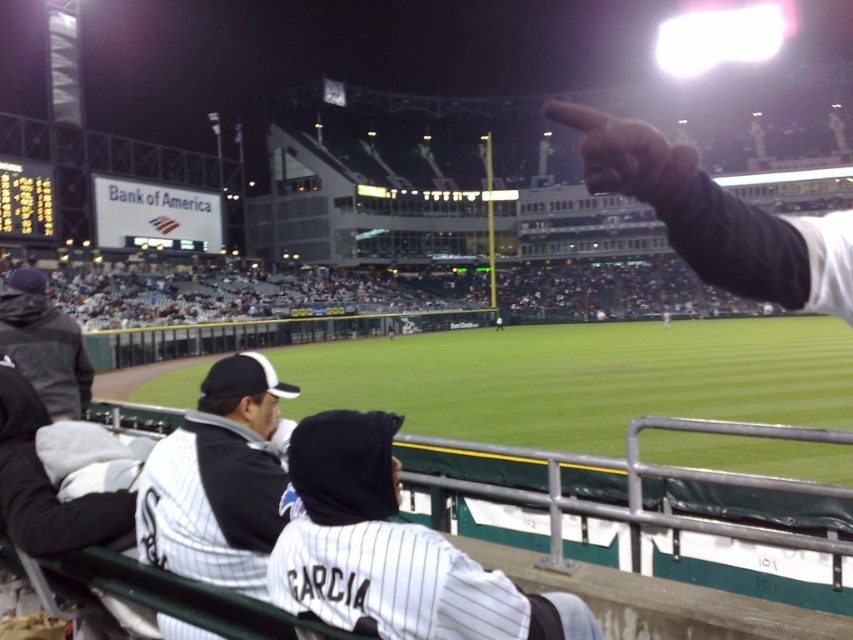
You are a photographer at the baseball stadium and want to capture a photo that includes both the white pinstriped jersey at center and the matte black finger at upper right. Based on their heights, which object should you focus on first to ensure both are in frame?

The white pinstriped jersey at center has a lesser height compared to the matte black finger at upper right, so you should focus on the matte black finger at upper right first to ensure both are in frame.

You are a photographer at the baseball stadium and want to take a photo of the white pinstriped jersey at center. Where should you position yourself to ensure the jersey is in the center of your photo?

To center the white pinstriped jersey at center in your photo, position yourself directly in line with its coordinates at point (392, 550). This will ensure the jersey is centered in your frame.

You are a photographer standing in the baseball stadium and want to take a photo of the white pinstriped jersey at lower left and the matte black finger at upper right. Which object should you focus on first if you want to capture both in a single shot without changing the camera focus?

You should focus on the white pinstriped jersey at lower left first because it is closer to you than the matte black finger at upper right, allowing both to be in focus if they are within the same depth of field.